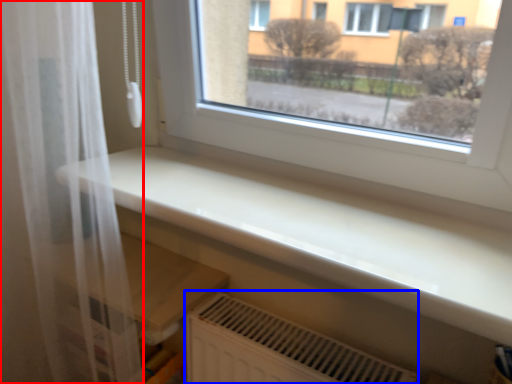
Question: Which point is further to the camera, shower curtain (highlighted by a red box) or air conditioning (highlighted by a blue box)?

Choices:
 (A) shower curtain
 (B) air conditioning

Answer: (B)